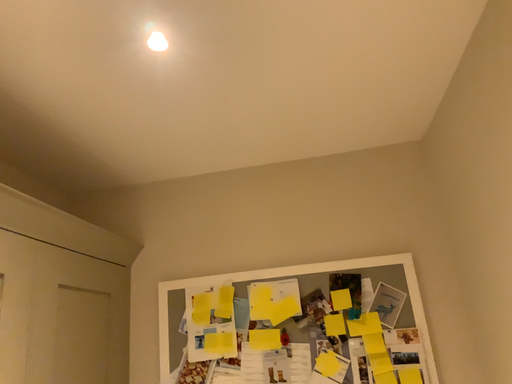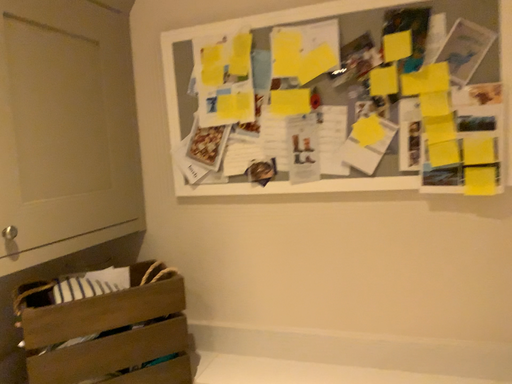
Question: Which way did the camera rotate in the video?

Choices:
 (A) rotated downward
 (B) rotated upward

Answer: (A)